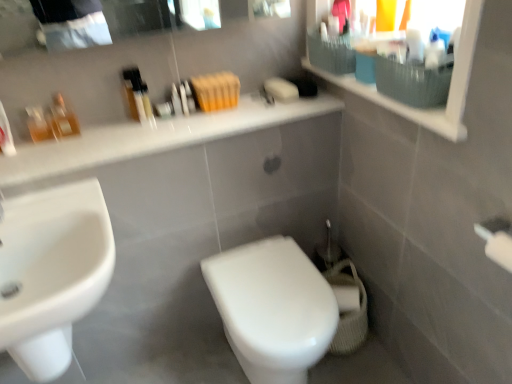
Question: From the image's perspective, is white glossy toilet at center above or below matte white medicine cabinet at upper right?

Choices:
 (A) below
 (B) above

Answer: (A)

Question: From a real-world perspective, is white glossy toilet at center physically located above or below matte white medicine cabinet at upper right?

Choices:
 (A) above
 (B) below

Answer: (B)

Question: Estimate the real-world distances between objects in this image. Which object is farther from the white glossy countertop at upper center?

Choices:
 (A) translucent glass bottles at left, which is counted as the first toiletry, starting from the left
 (B) white glossy toilet at center
 (C) matte white medicine cabinet at upper right
 (D) textured grey basket at upper right
 (E) translucent plastic bottles at upper center, the 3th toiletry in the left-to-right sequence

Answer: (B)

Question: Estimate the real-world distances between objects in this image. Which object is farther from the textured grey basket at upper right?

Choices:
 (A) matte white medicine cabinet at upper right
 (B) white glossy countertop at upper center
 (C) white glossy toilet at center
 (D) white glossy sink at lower left
 (E) white glossy faucet at left

Answer: (E)